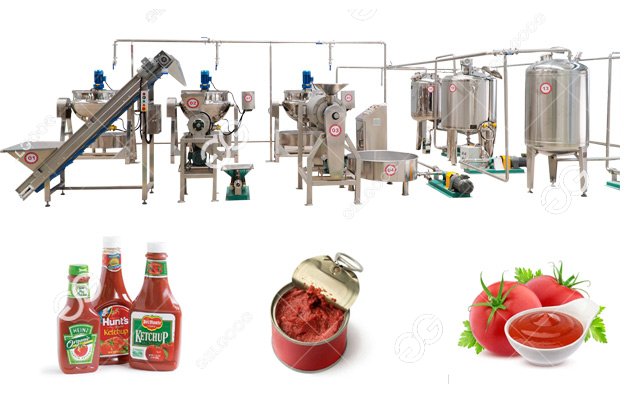
Find the location of a particular element. The width and height of the screenshot is (630, 400). stainless cylindrical container is located at coordinates 554,133, 471,113, 419,99.